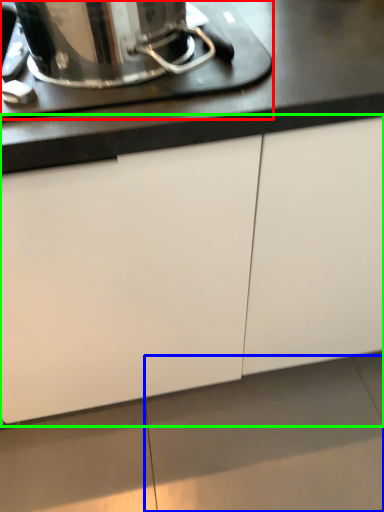
Question: Considering the real-world distances, which object is farthest from home appliance (highlighted by a red box)? tile (highlighted by a blue box) or cabinetry (highlighted by a green box)?

Choices:
 (A) tile
 (B) cabinetry

Answer: (A)